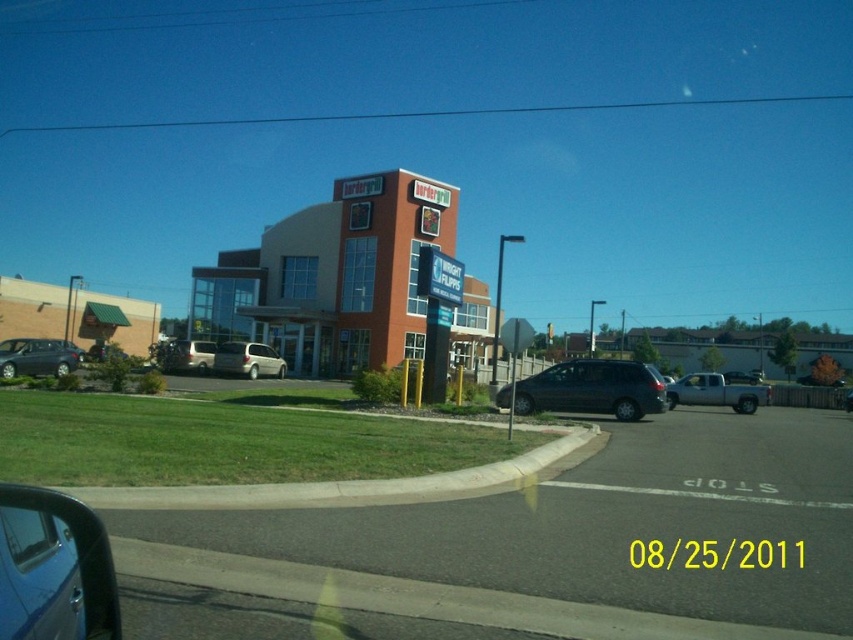
Does point (277, 374) lie in front of point (192, 348)?

That is False.

Who is more distant from viewer, (248, 356) or (167, 352)?

Positioned behind is point (167, 352).

At what (x,y) coordinates should I click in order to perform the action: click on silver metallic minivan at center. Please return your answer as a coordinate pair (x, y). Looking at the image, I should click on (247, 360).

Where is `silver metallic minivan at center`? silver metallic minivan at center is located at coordinates (247, 360).

Can you confirm if satin gray minivan at center is positioned below silver metallic truck at right?

Actually, satin gray minivan at center is above silver metallic truck at right.

Is satin gray minivan at center bigger than silver metallic truck at right?

No.

Identify the location of satin gray minivan at center. This screenshot has width=853, height=640. (593, 388).

Does point (723, 392) come behind point (206, 344)?

That is False.

Is silver metallic truck at right shorter than silver metallic van at center-left?

Incorrect, silver metallic truck at right's height does not fall short of silver metallic van at center-left's.

What are the coordinates of `silver metallic truck at right` in the screenshot? It's located at (717, 392).